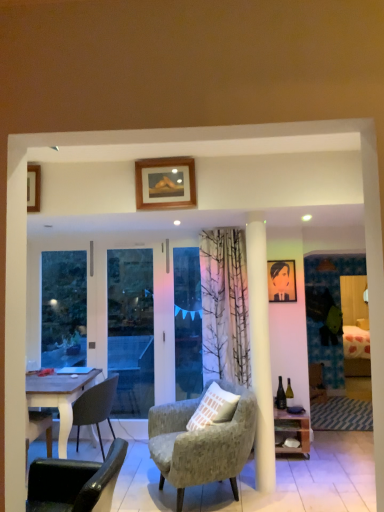
Question: Do you think transparent glass screen door at left is within textured gray armchair at center, arranged as the 1th chair when viewed from the right, or outside of it?

Choices:
 (A) outside
 (B) inside

Answer: (A)

Question: Does point (180, 386) appear closer or farther from the camera than point (155, 409)?

Choices:
 (A) farther
 (B) closer

Answer: (A)

Question: Considering the real-world distances, which object is farthest from the transparent glass screen door at left?

Choices:
 (A) wooden shelf at lower right
 (B) transparent glass door at center
 (C) textured gray armchair at center, arranged as the second chair when viewed from the front
 (D) green glass bottle at center-right
 (E) black leather chair at lower left, which is the first chair in front-to-back order

Answer: (E)

Question: Which object is the closest to the wooden shelf at lower right?

Choices:
 (A) transparent glass screen door at left
 (B) wooden picture frame at upper center, which is the first picture frame from front to back
 (C) transparent glass door at center
 (D) matte black portrait at upper right, marked as the 2th picture frame in a top-to-bottom arrangement
 (E) textured gray armchair at center, which appears as the 2th chair when viewed from the back

Answer: (E)